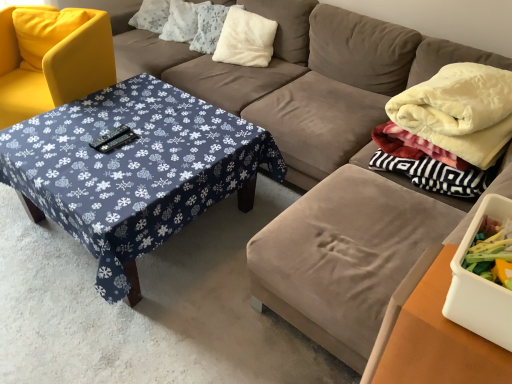
Question: From the image's perspective, is white fluffy pillow at center, arranged as the second pillow when viewed from the right, on top of white fluffy pillow at upper center, which is the 1th pillow from left to right?

Choices:
 (A) no
 (B) yes

Answer: (A)

Question: Is white fluffy pillow at center, arranged as the second pillow when viewed from the right, closer to the viewer compared to white fluffy pillow at upper center, the third pillow when ordered from right to left?

Choices:
 (A) yes
 (B) no

Answer: (A)

Question: Is white fluffy pillow at center, arranged as the second pillow when viewed from the right, placed right next to white fluffy pillow at upper center, which is the 1th pillow from left to right?

Choices:
 (A) yes
 (B) no

Answer: (B)

Question: Does white fluffy pillow at center, arranged as the second pillow when viewed from the right, contain white fluffy pillow at upper center, the third pillow when ordered from right to left?

Choices:
 (A) no
 (B) yes

Answer: (A)

Question: Is white fluffy pillow at center, arranged as the second pillow when viewed from the right, aimed at white fluffy pillow at upper center, which is the 1th pillow from left to right?

Choices:
 (A) no
 (B) yes

Answer: (A)

Question: From a real-world perspective, is velvet white blanket at right above or below yellow fabric chair at left?

Choices:
 (A) above
 (B) below

Answer: (A)

Question: Would you say velvet white blanket at right is to the left or to the right of yellow fabric chair at left in the picture?

Choices:
 (A) right
 (B) left

Answer: (A)

Question: Considering the positions of velvet white blanket at right and yellow fabric chair at left in the image, is velvet white blanket at right bigger or smaller than yellow fabric chair at left?

Choices:
 (A) big
 (B) small

Answer: (B)

Question: Is point (398, 104) closer or farther from the camera than point (108, 19)?

Choices:
 (A) farther
 (B) closer

Answer: (B)

Question: From a real-world perspective, relative to white fluffy pillow at upper center, which is the 1th pillow from left to right, is blue fabric-covered table at center-left vertically above or below?

Choices:
 (A) above
 (B) below

Answer: (B)

Question: Is blue fabric-covered table at center-left situated inside white fluffy pillow at upper center, the third pillow when ordered from right to left, or outside?

Choices:
 (A) inside
 (B) outside

Answer: (B)

Question: In terms of width, does blue fabric-covered table at center-left look wider or thinner when compared to white fluffy pillow at upper center, the third pillow when ordered from right to left?

Choices:
 (A) thin
 (B) wide

Answer: (B)

Question: Is point (181, 223) positioned closer to the camera than point (167, 21)?

Choices:
 (A) closer
 (B) farther

Answer: (A)

Question: From the image's perspective, is white fluffy pillow at upper center, which is the 1th pillow from left to right, positioned above or below wooden table at lower right?

Choices:
 (A) above
 (B) below

Answer: (A)

Question: Considering the positions of white fluffy pillow at upper center, which is the 1th pillow from left to right, and wooden table at lower right in the image, is white fluffy pillow at upper center, which is the 1th pillow from left to right, bigger or smaller than wooden table at lower right?

Choices:
 (A) big
 (B) small

Answer: (B)